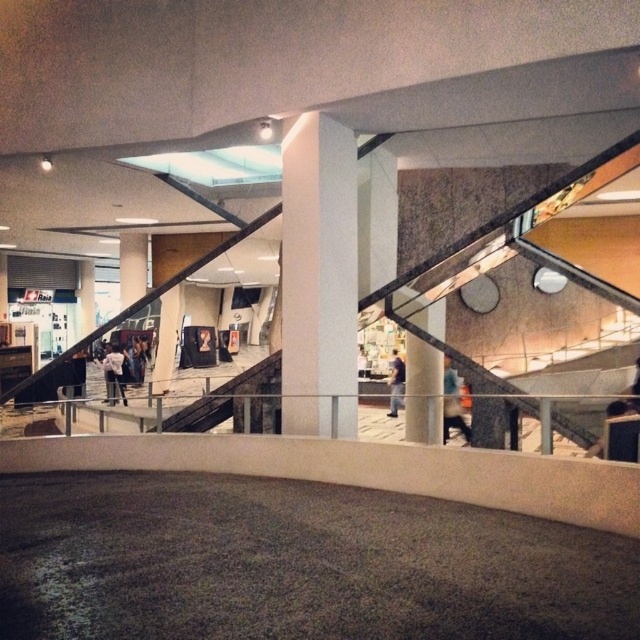
Question: Considering the real-world distances, which object is farthest from the white smooth pillar at center?

Choices:
 (A) blue fabric jacket at center
 (B) white matte jacket at lower left
 (C) dark blue jeans at center

Answer: (C)

Question: Can you confirm if blue fabric jacket at center is positioned above white matte jacket at lower left?

Choices:
 (A) no
 (B) yes

Answer: (A)

Question: Based on their relative distances, which object is nearer to the dark blue jeans at center?

Choices:
 (A) white smooth pillar at center
 (B) white matte jacket at lower left
 (C) blue fabric jacket at center

Answer: (C)

Question: Is white matte jacket at lower left thinner than dark blue jeans at center?

Choices:
 (A) no
 (B) yes

Answer: (B)

Question: Is white smooth pillar at center wider than dark blue jeans at center?

Choices:
 (A) no
 (B) yes

Answer: (B)

Question: Which is farther from the concrete staircase at center?

Choices:
 (A) dark blue jeans at center
 (B) white matte jacket at lower left

Answer: (A)